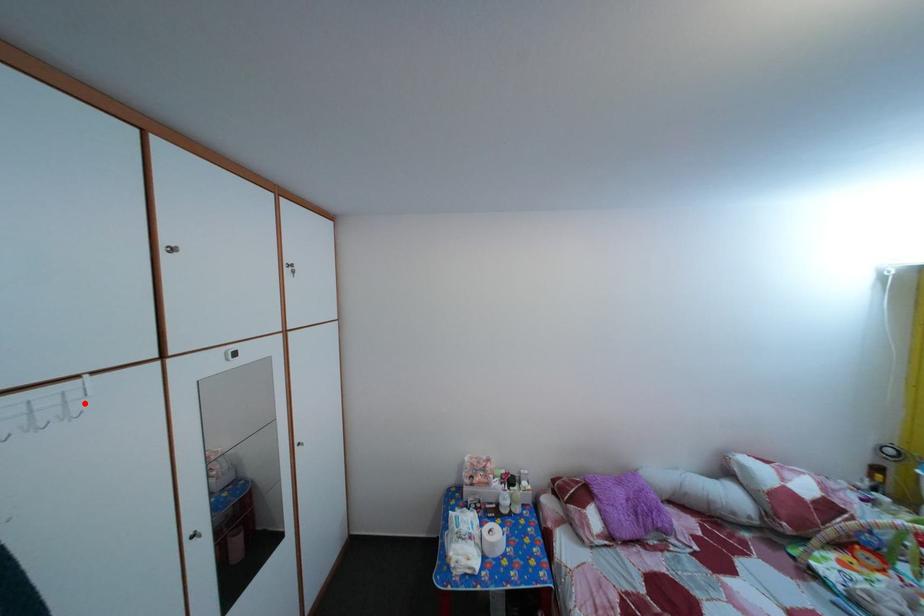
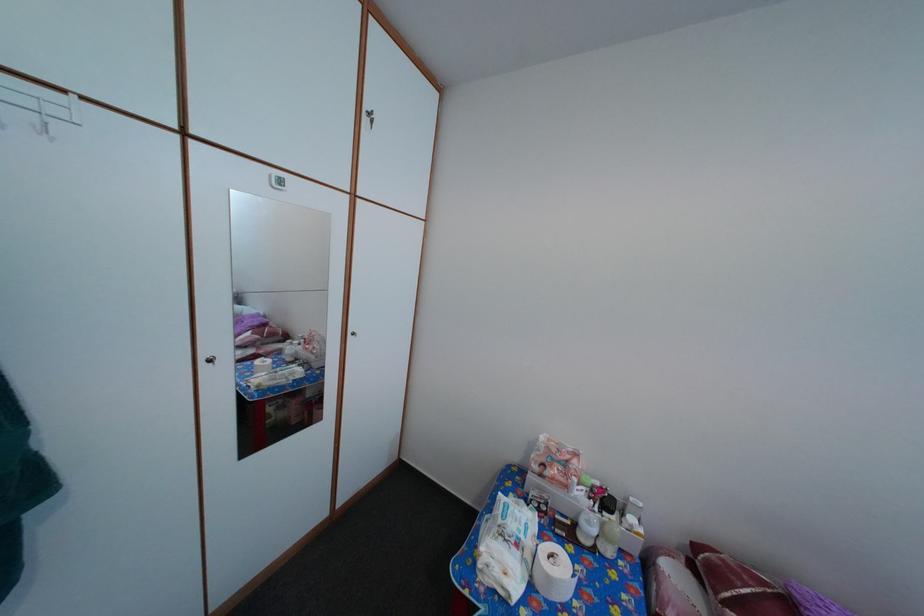
Find the pixel in the second image that matches the highlighted location in the first image.

(66, 120)